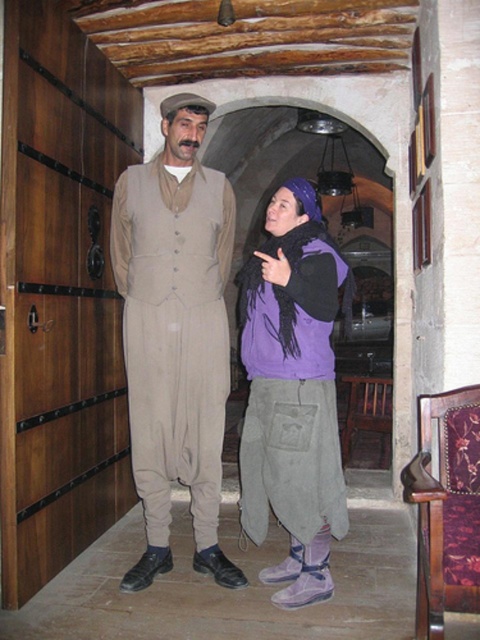
You are a photographer trying to capture both the beige fabric suit at center and the purple fleece vest at center in a single frame. Based on their sizes, which one should you focus on to ensure both fit comfortably in the photo?

The beige fabric suit at center might be wider than purple fleece vest at center, so focusing on the beige fabric suit at center would ensure both fit comfortably in the photo.

You are standing at point (x=211, y=173) and want to approach the two people in the scene. Which direction should you move to get closer to both of them?

Since the two people are 2.81 meters apart, moving towards the midpoint between them would allow you to approach both individuals simultaneously.

You are a costume designer who needs to determine which costume requires more fabric. You see the beige fabric suit at center and the purple fleece vest at center in the scene. Based on their sizes, which one would need more fabric?

The beige fabric suit at center is bigger than the purple fleece vest at center, so it would require more fabric.